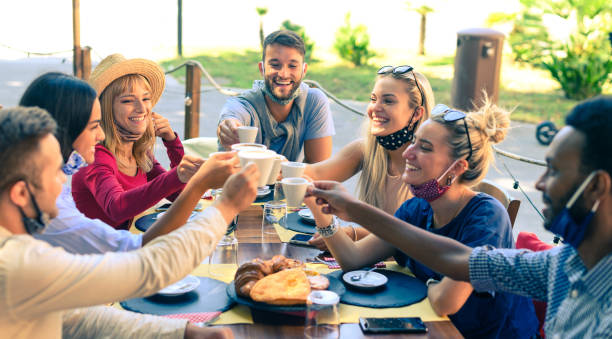
At what (x,y) coordinates should I click in order to perform the action: click on placemats. Please return your answer as a coordinate pair (x, y). Looking at the image, I should click on (341, 317), (220, 274), (132, 229), (285, 231), (255, 205).